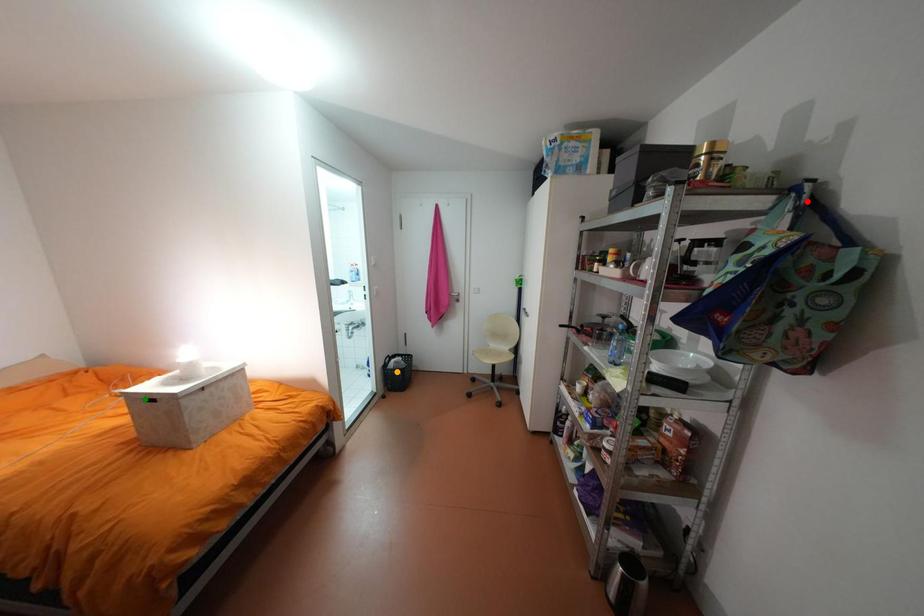
Order these from nearest to farthest:
orange point, red point, green point

orange point → green point → red point